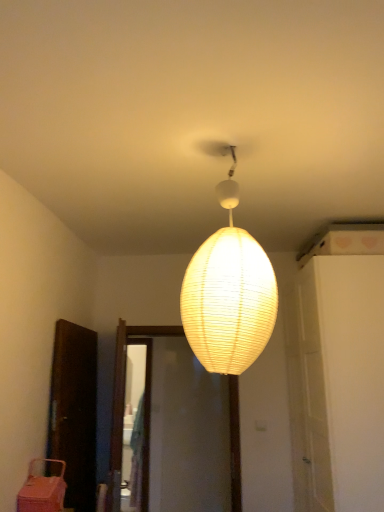
Question: Is pink plastic basket at lower left shorter than ivory paper lampshade at center?

Choices:
 (A) yes
 (B) no

Answer: (A)

Question: Can you confirm if pink plastic basket at lower left is wider than ivory paper lampshade at center?

Choices:
 (A) yes
 (B) no

Answer: (B)

Question: Considering the relative sizes of pink plastic basket at lower left and ivory paper lampshade at center in the image provided, is pink plastic basket at lower left bigger than ivory paper lampshade at center?

Choices:
 (A) yes
 (B) no

Answer: (B)

Question: Would you say pink plastic basket at lower left is a long distance from ivory paper lampshade at center?

Choices:
 (A) yes
 (B) no

Answer: (A)

Question: Is pink plastic basket at lower left aimed at ivory paper lampshade at center?

Choices:
 (A) yes
 (B) no

Answer: (B)

Question: From a real-world perspective, is pink plastic basket at lower left positioned under ivory paper lampshade at center based on gravity?

Choices:
 (A) yes
 (B) no

Answer: (A)

Question: Is pink plastic basket at lower left oriented towards white matte door at center right?

Choices:
 (A) no
 (B) yes

Answer: (B)

Question: Can you confirm if pink plastic basket at lower left is positioned to the right of white matte door at center right?

Choices:
 (A) yes
 (B) no

Answer: (B)

Question: From the image's perspective, is pink plastic basket at lower left located beneath white matte door at center right?

Choices:
 (A) yes
 (B) no

Answer: (A)

Question: Can you confirm if pink plastic basket at lower left is bigger than white matte door at center right?

Choices:
 (A) yes
 (B) no

Answer: (B)

Question: Would you say white matte door at center right is part of pink plastic basket at lower left's contents?

Choices:
 (A) yes
 (B) no

Answer: (B)

Question: Can you confirm if pink plastic basket at lower left is wider than white matte door at center right?

Choices:
 (A) no
 (B) yes

Answer: (A)

Question: From the image's perspective, does white matte door at center right appear higher than ivory paper lampshade at center?

Choices:
 (A) no
 (B) yes

Answer: (A)